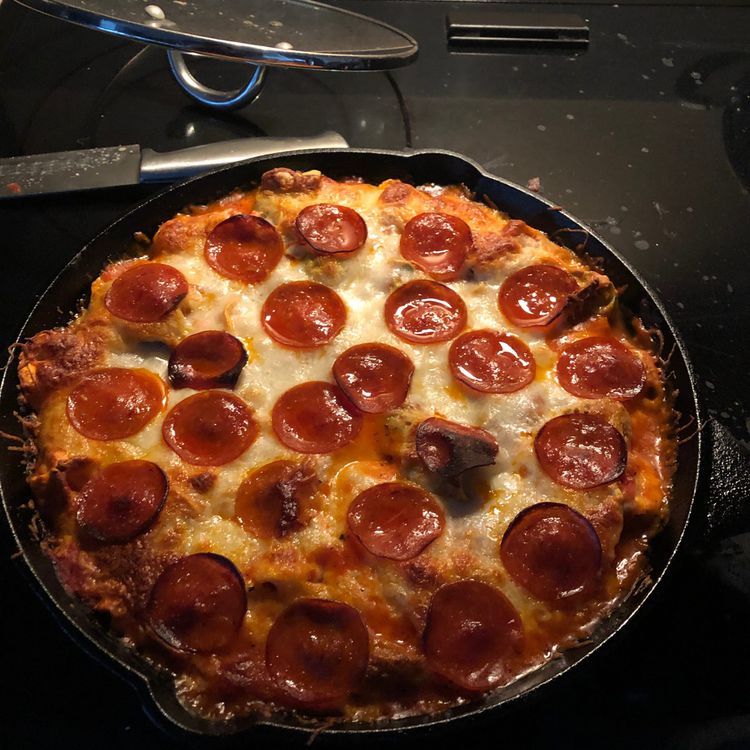
Image resolution: width=750 pixels, height=750 pixels. Identify the location of grater. (88, 158).